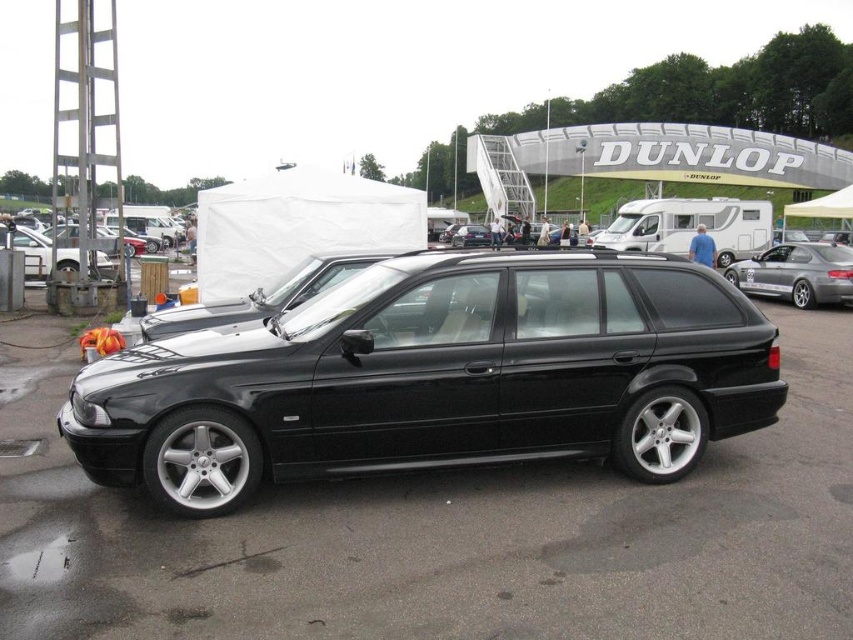
You are standing in front of the black BMW E39 Touring station wagon at the car exhibition. There are two points marked on the car, one at coordinates point (494, 403) and another at point (763, 294). Which of these two points is closer to your viewpoint?

Point (494, 403) is closer to the camera than point (763, 294).

You are standing at the back of the black BMW E39 Touring station wagon at the car event. You want to walk to the point marked as point (793, 288). Is this point closer to you or farther away from you compared to point (22, 227)?

Point (793, 288) is in front of point (22, 227). Since you are at the back of the car, the point (793, 288) would be closer to you than point (22, 227).